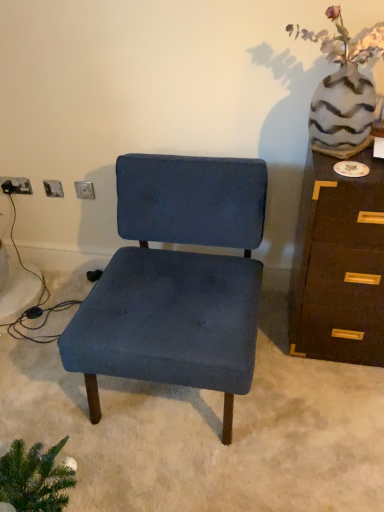
Locate an element on the screen. vacant area that lies between brown wood chest of drawers at right and velvet blue chair at center is located at coordinates (307, 384).